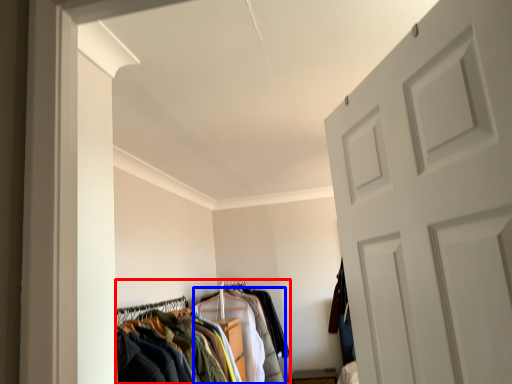
Question: Which of the following is the closest to the observer, closet (highlighted by a red box) or clothing (highlighted by a blue box)?

Choices:
 (A) closet
 (B) clothing

Answer: (A)